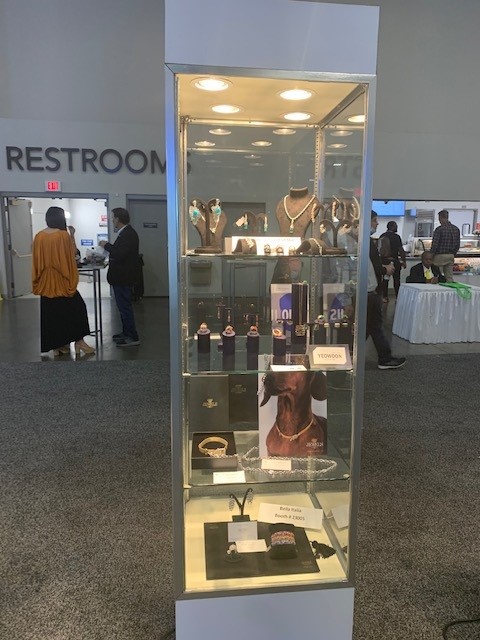
The image size is (480, 640). Identify the location of table. (97, 266).